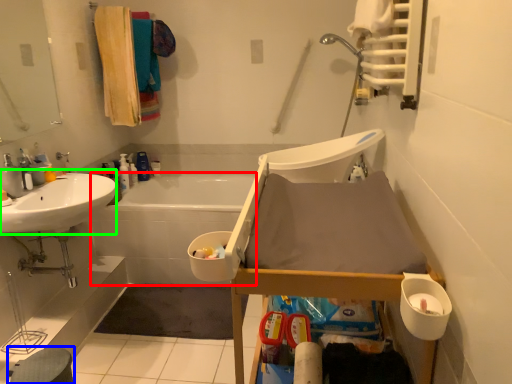
Question: Which object is positioned farthest from bath (highlighted by a red box)? Select from step stool (highlighted by a blue box) and sink (highlighted by a green box).

Choices:
 (A) step stool
 (B) sink

Answer: (A)